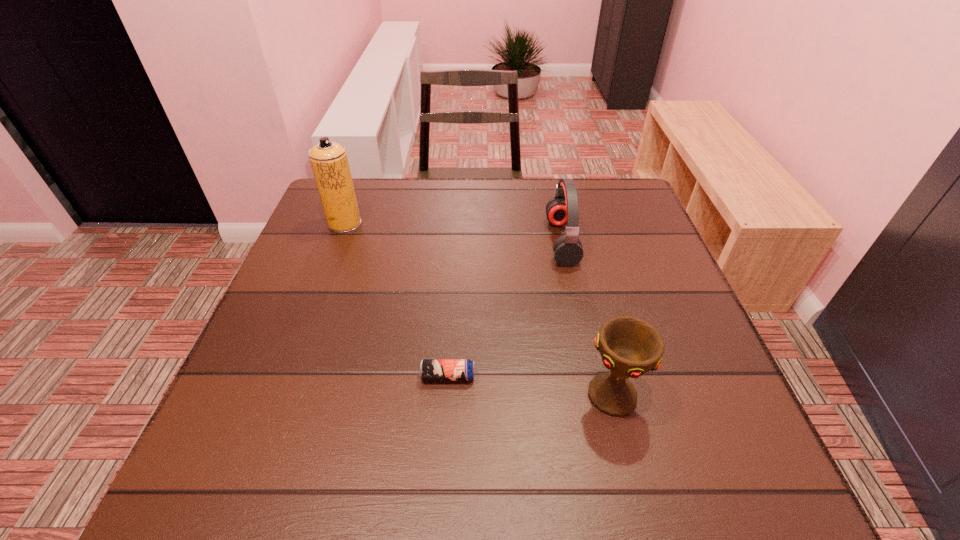
Where is `empty space between the third object from right to left and the leftmost object`? Image resolution: width=960 pixels, height=540 pixels. empty space between the third object from right to left and the leftmost object is located at coordinates (396, 300).

Locate an element on the screen. The image size is (960, 540). free space that is in between the earphone and the beer can is located at coordinates (505, 309).

The width and height of the screenshot is (960, 540). I want to click on vacant area between the tallest object and the chalice, so click(x=478, y=310).

This screenshot has height=540, width=960. I want to click on vacant space in between the chalice and the earphone, so click(x=587, y=319).

Image resolution: width=960 pixels, height=540 pixels. I want to click on empty space between the shortest object and the earphone, so click(505, 309).

Where is `unoccupied position between the third object from right to left and the aerosol can`? Image resolution: width=960 pixels, height=540 pixels. unoccupied position between the third object from right to left and the aerosol can is located at coordinates (396, 300).

At what (x,y) coordinates should I click in order to perform the action: click on unoccupied area between the shortest object and the chalice. Please return your answer as a coordinate pair (x, y). Looking at the image, I should click on (530, 386).

The height and width of the screenshot is (540, 960). In order to click on free spot between the earphone and the chalice in this screenshot , I will do `click(587, 319)`.

Where is `empty location between the tallest object and the chalice`? This screenshot has width=960, height=540. empty location between the tallest object and the chalice is located at coordinates (478, 310).

Where is `free space between the chalice and the beer can`? The height and width of the screenshot is (540, 960). free space between the chalice and the beer can is located at coordinates (530, 386).